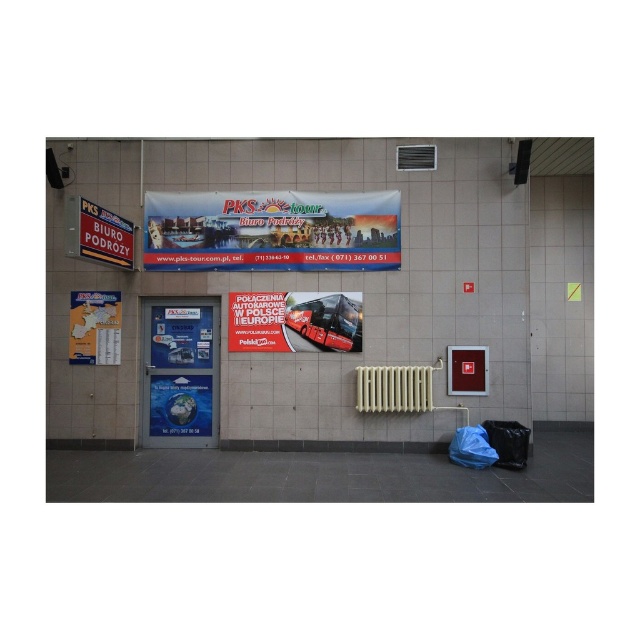
Question: Which of these objects is positioned farthest from the white plastic sign at upper left?

Choices:
 (A) matte plastic banner at center
 (B) blue glossy poster at center

Answer: (B)

Question: Among these objects, which one is farthest from the camera?

Choices:
 (A) matte plastic banner at center
 (B) matte plastic sign at center
 (C) white plastic sign at upper left
 (D) yellow paper map at left

Answer: (B)

Question: Is red glossy bus at center to the right of blue glossy poster at center from the viewer's perspective?

Choices:
 (A) yes
 (B) no

Answer: (A)

Question: Is matte plastic banner at center bigger than white plastic radiator at center?

Choices:
 (A) no
 (B) yes

Answer: (B)

Question: Which point is farther to the camera?

Choices:
 (A) white plastic radiator at center
 (B) yellow paper map at left
 (C) matte plastic banner at center
 (D) white plastic sign at upper left

Answer: (B)

Question: Observing the image, what is the correct spatial positioning of matte plastic sign at center in reference to white plastic radiator at center?

Choices:
 (A) right
 (B) left

Answer: (B)